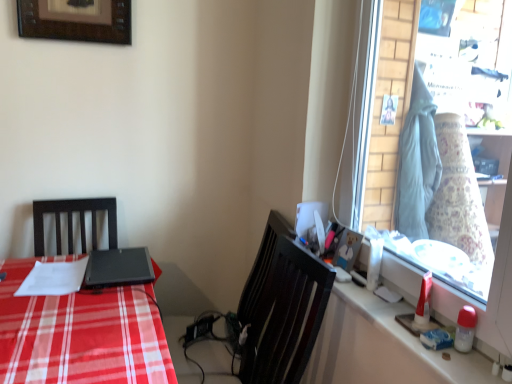
Question: Does matte black desk at left have a greater height compared to matte plastic picture frame at upper right, the 1th picture frame when ordered from right to left?

Choices:
 (A) no
 (B) yes

Answer: (B)

Question: From the image's perspective, is matte black desk at left located beneath matte plastic picture frame at upper right, the 1th picture frame when ordered from right to left?

Choices:
 (A) yes
 (B) no

Answer: (A)

Question: Is matte black desk at left looking in the opposite direction of matte plastic picture frame at upper right, the 2th picture frame in the top-to-bottom sequence?

Choices:
 (A) yes
 (B) no

Answer: (B)

Question: Is matte black desk at left positioned before matte plastic picture frame at upper right, which is the 2th picture frame from back to front?

Choices:
 (A) no
 (B) yes

Answer: (B)

Question: Is matte black desk at left next to matte plastic picture frame at upper right, the 1th picture frame viewed from the front, and touching it?

Choices:
 (A) no
 (B) yes

Answer: (A)

Question: From a real-world perspective, is matte black desk at left located higher than matte plastic picture frame at upper right, which is the 2th picture frame from back to front?

Choices:
 (A) no
 (B) yes

Answer: (A)

Question: From the image's perspective, is glass window at right on matte plastic picture frame at upper right, the 1th picture frame when ordered from right to left?

Choices:
 (A) no
 (B) yes

Answer: (B)

Question: Is glass window at right looking in the opposite direction of matte plastic picture frame at upper right, the 2th picture frame in the top-to-bottom sequence?

Choices:
 (A) no
 (B) yes

Answer: (B)

Question: Is glass window at right at the right side of matte plastic picture frame at upper right, which is the 2th picture frame from back to front?

Choices:
 (A) no
 (B) yes

Answer: (B)

Question: Is glass window at right placed right next to matte plastic picture frame at upper right, the 1th picture frame viewed from the front?

Choices:
 (A) no
 (B) yes

Answer: (A)

Question: From a real-world perspective, is glass window at right over matte plastic picture frame at upper right, the 2th picture frame in the top-to-bottom sequence?

Choices:
 (A) yes
 (B) no

Answer: (A)

Question: Can you confirm if glass window at right is taller than matte plastic picture frame at upper right, which ranks as the first picture frame in bottom-to-top order?

Choices:
 (A) no
 (B) yes

Answer: (B)

Question: Is white glossy counter top at right to the left of glass window at right from the viewer's perspective?

Choices:
 (A) no
 (B) yes

Answer: (B)